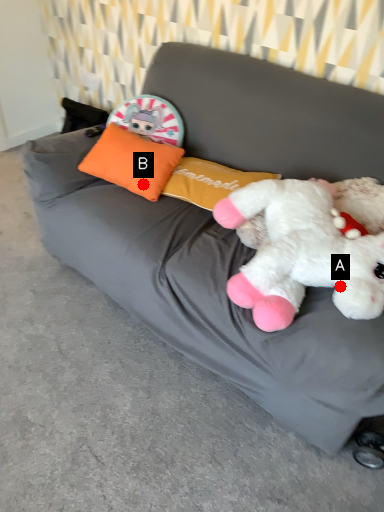
Question: Two points are circled on the image, labeled by A and B beside each circle. Which point appears farthest from the camera in this image?

Choices:
 (A) A is further
 (B) B is further

Answer: (B)